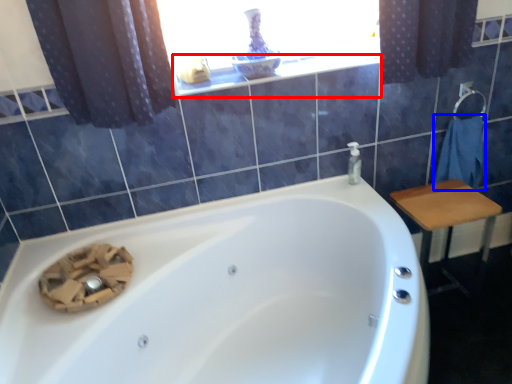
Question: Among these objects, which one is farthest to the camera, window sill (highlighted by a red box) or bath towel (highlighted by a blue box)?

Choices:
 (A) window sill
 (B) bath towel

Answer: (B)